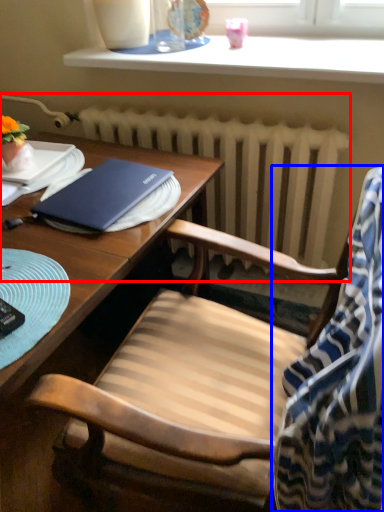
Question: Which of the following is the closest to the observer, radiator (highlighted by a red box) or blanket (highlighted by a blue box)?

Choices:
 (A) radiator
 (B) blanket

Answer: (B)